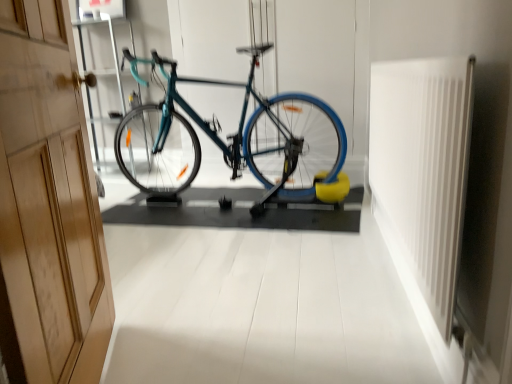
This screenshot has height=384, width=512. What are the coordinates of `white plastic radiator at right` in the screenshot? It's located at (423, 168).

Where is `teal glossy bicycle at center`? The height and width of the screenshot is (384, 512). teal glossy bicycle at center is located at coordinates (233, 138).

Between white plastic radiator at right and teal glossy bicycle at center, which one has more height?

teal glossy bicycle at center is taller.

From the image's perspective, does white plastic radiator at right appear lower than teal glossy bicycle at center?

Yes.

Consider the image. Is white plastic radiator at right not inside teal glossy bicycle at center?

Absolutely, white plastic radiator at right is external to teal glossy bicycle at center.

Is white plastic radiator at right at the left side of teal glossy bicycle at center?

In fact, white plastic radiator at right is to the right of teal glossy bicycle at center.

Considering the positions of point (431, 309) and point (102, 278), is point (431, 309) closer or farther from the camera than point (102, 278)?

Point (431, 309) is closer to the camera than point (102, 278).

Is white plastic radiator at right further to camera compared to wooden at left?

That is True.

Is white plastic radiator at right not within wooden at left?

white plastic radiator at right is positioned outside wooden at left.

Is white plastic radiator at right to the left of wooden at left from the viewer's perspective?

No.

Does wooden at left have a lesser height compared to white plastic radiator at right?

No.

Is wooden at left in front of white plastic radiator at right?

Yes, wooden at left is closer to the camera.

Is point (4, 212) positioned in front of point (418, 155)?

That is True.

Can we say wooden at left lies outside white plastic radiator at right?

wooden at left lies outside white plastic radiator at right's area.

From a real-world perspective, is teal glossy bicycle at center physically above white plastic radiator at right?

Yes, from a real-world perspective, teal glossy bicycle at center is on top of white plastic radiator at right.

From the image's perspective, is teal glossy bicycle at center located above white plastic radiator at right?

Yes, from the image's perspective, teal glossy bicycle at center is above white plastic radiator at right.

Which is behind, teal glossy bicycle at center or white plastic radiator at right?

teal glossy bicycle at center is further away from the camera.

Is wooden at left far away from teal glossy bicycle at center?

Yes, wooden at left and teal glossy bicycle at center are quite far apart.

From the image's perspective, between wooden at left and teal glossy bicycle at center, which one is located above?

teal glossy bicycle at center.

How many degrees apart are the facing directions of wooden at left and teal glossy bicycle at center?

The angle between the facing direction of wooden at left and the facing direction of teal glossy bicycle at center is 60.6 degrees.

From a real-world perspective, does teal glossy bicycle at center stand above wooden at left?

Yes, from a real-world perspective, teal glossy bicycle at center is on top of wooden at left.

Is teal glossy bicycle at center wider or thinner than wooden at left?

Considering their sizes, teal glossy bicycle at center looks broader than wooden at left.

In the image, there is a teal glossy bicycle at center. At what (x,y) coordinates should I click in order to perform the action: click on door below it (from the image's perspective). Please return your answer as a coordinate pair (x, y). The width and height of the screenshot is (512, 384). Looking at the image, I should click on point(48,206).

Is teal glossy bicycle at center further to the viewer compared to wooden at left?

Yes, teal glossy bicycle at center is further from the camera.

The height and width of the screenshot is (384, 512). Identify the location of bicycle lying on the left of white plastic radiator at right. (233, 138).

Identify the location of radiator below the wooden at left (from a real-world perspective). (423, 168).

Consider the image. Based on their spatial positions, is wooden at left or teal glossy bicycle at center closer to white plastic radiator at right?

The object closer to white plastic radiator at right is wooden at left.

Based on their spatial positions, is teal glossy bicycle at center or white plastic radiator at right closer to wooden at left?

white plastic radiator at right is closer to wooden at left.

From the image, which object appears to be farther from teal glossy bicycle at center, white plastic radiator at right or wooden at left?

The object further to teal glossy bicycle at center is wooden at left.

In the scene shown: Looking at the image, which one is located closer to wooden at left, white plastic radiator at right or teal glossy bicycle at center?

Among the two, white plastic radiator at right is located nearer to wooden at left.

Based on their spatial positions, is wooden at left or white plastic radiator at right closer to teal glossy bicycle at center?

white plastic radiator at right is closer to teal glossy bicycle at center.

Which object lies nearer to the anchor point white plastic radiator at right, teal glossy bicycle at center or wooden at left?

wooden at left is positioned closer to the anchor white plastic radiator at right.

Locate an element on the screen. The width and height of the screenshot is (512, 384). radiator between wooden at left and teal glossy bicycle at center along the z-axis is located at coordinates (423, 168).